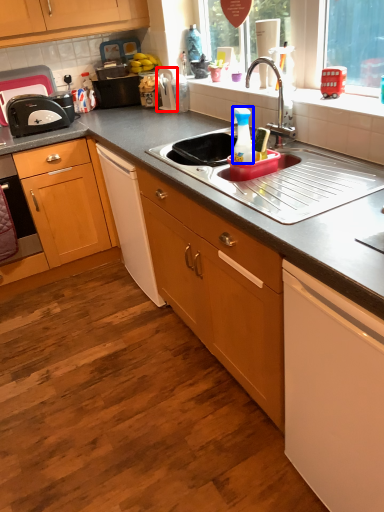
Question: Which point is further to the camera, appliance (highlighted by a red box) or bottle (highlighted by a blue box)?

Choices:
 (A) appliance
 (B) bottle

Answer: (A)